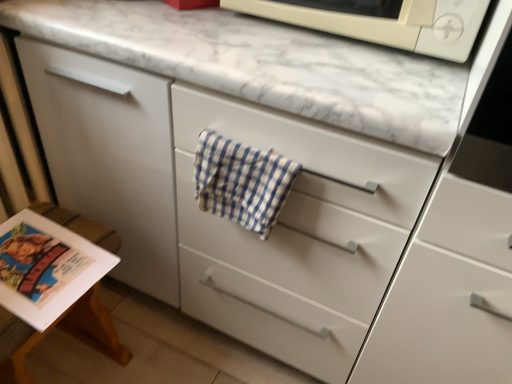
Question: Can you confirm if white matte microwave at upper center is positioned to the left of matte paper magazine at lower left?

Choices:
 (A) no
 (B) yes

Answer: (A)

Question: Is white matte microwave at upper center further to the viewer compared to matte paper magazine at lower left?

Choices:
 (A) yes
 (B) no

Answer: (B)

Question: From a real-world perspective, is white matte microwave at upper center beneath matte paper magazine at lower left?

Choices:
 (A) yes
 (B) no

Answer: (B)

Question: Is white matte microwave at upper center oriented towards matte paper magazine at lower left?

Choices:
 (A) no
 (B) yes

Answer: (A)

Question: Is matte paper magazine at lower left surrounded by white matte microwave at upper center?

Choices:
 (A) yes
 (B) no

Answer: (B)

Question: Is point (263, 1) closer or farther from the camera than point (218, 195)?

Choices:
 (A) closer
 (B) farther

Answer: (B)

Question: From the image's perspective, relative to blue checkered towel at center, is white matte microwave at upper center above or below?

Choices:
 (A) below
 (B) above

Answer: (B)

Question: Considering the positions of white matte microwave at upper center and blue checkered towel at center in the image, is white matte microwave at upper center wider or thinner than blue checkered towel at center?

Choices:
 (A) wide
 (B) thin

Answer: (A)

Question: In the image, is white matte microwave at upper center positioned in front of or behind blue checkered towel at center?

Choices:
 (A) front
 (B) behind

Answer: (A)

Question: Relative to matte paper magazine at lower left, is white matte microwave at upper center in front or behind?

Choices:
 (A) front
 (B) behind

Answer: (A)

Question: In terms of height, does white matte microwave at upper center look taller or shorter compared to matte paper magazine at lower left?

Choices:
 (A) tall
 (B) short

Answer: (B)

Question: From a real-world perspective, relative to matte paper magazine at lower left, is white matte microwave at upper center vertically above or below?

Choices:
 (A) below
 (B) above

Answer: (B)

Question: Is point (458, 59) positioned closer to the camera than point (56, 306)?

Choices:
 (A) farther
 (B) closer

Answer: (B)

Question: From a real-world perspective, is blue checkered towel at center physically located above or below matte paper magazine at lower left?

Choices:
 (A) below
 (B) above

Answer: (B)

Question: Is blue checkered towel at center in front of or behind matte paper magazine at lower left in the image?

Choices:
 (A) front
 (B) behind

Answer: (A)